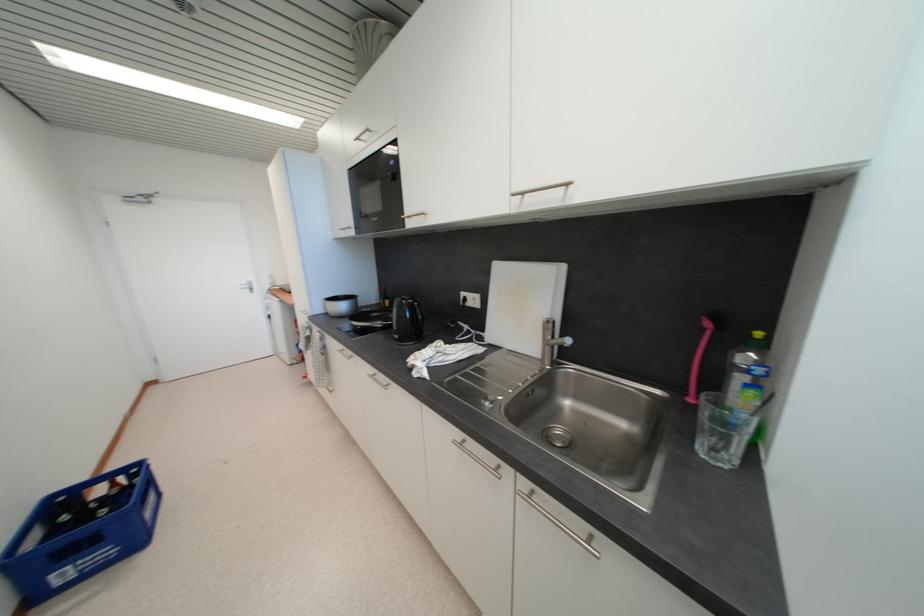
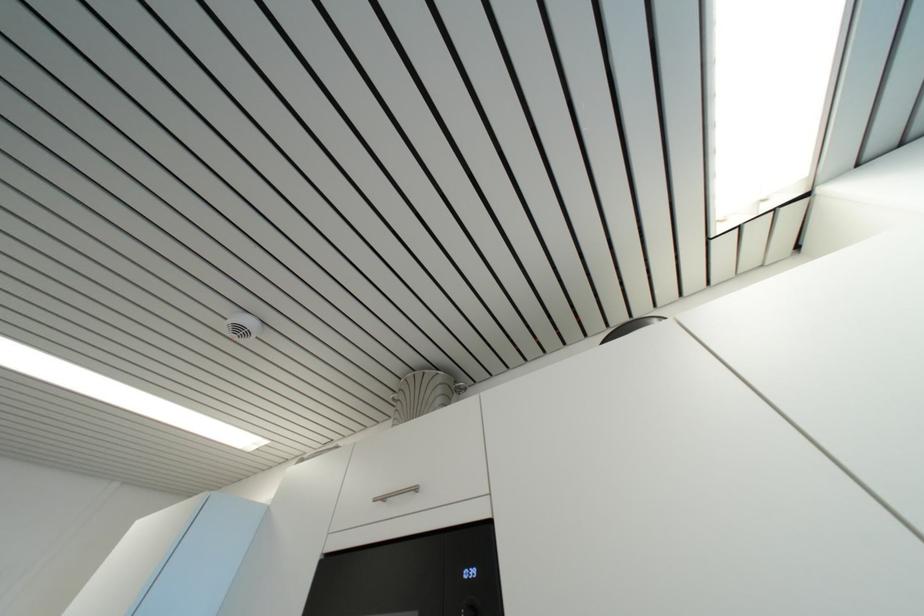
How did the camera likely rotate?

The rotation direction of the camera is right-up.